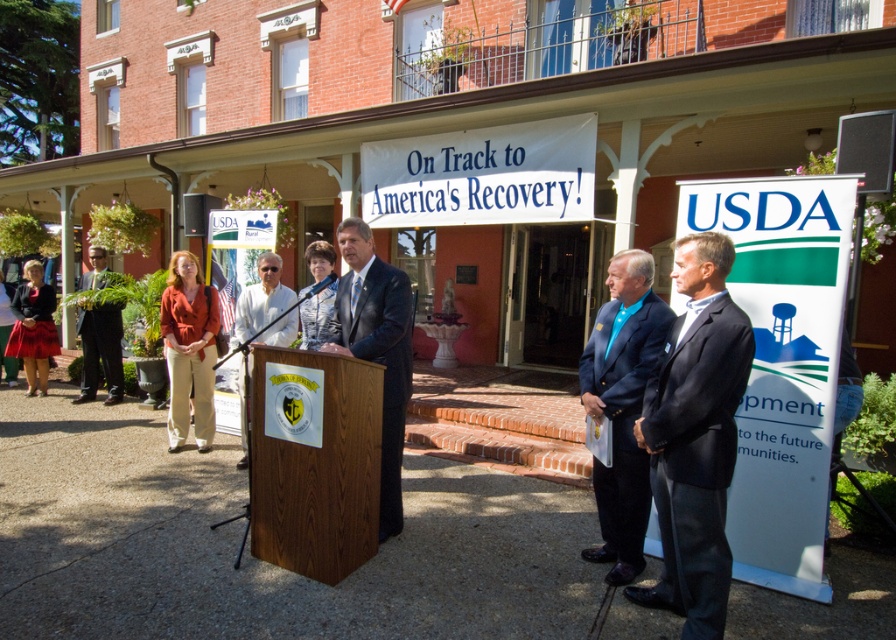
Is blue fabric suit at center bigger than dark suit at center?

Actually, blue fabric suit at center might be smaller than dark suit at center.

How much distance is there between blue fabric suit at center and dark suit at center?

The distance of blue fabric suit at center from dark suit at center is 1.29 meters.

In order to click on blue fabric suit at center in this screenshot , I will do 622,406.

This screenshot has width=896, height=640. What are the coordinates of `blue fabric suit at center` in the screenshot? It's located at (622, 406).

Between point (675, 413) and point (360, 307), which one is positioned behind?

The point (360, 307) is more distant.

Is dark gray suit at center below dark suit at center?

Yes, dark gray suit at center is below dark suit at center.

Between point (681, 483) and point (399, 509), which one is positioned behind?

The point (399, 509) is more distant.

Identify the location of dark gray suit at center. (695, 436).

Does dark gray suit at center appear over matte black jacket at lower left?

No.

Does dark gray suit at center have a larger size compared to matte black jacket at lower left?

Incorrect, dark gray suit at center is not larger than matte black jacket at lower left.

At what (x,y) coordinates should I click in order to perform the action: click on dark gray suit at center. Please return your answer as a coordinate pair (x, y). This screenshot has width=896, height=640. Looking at the image, I should click on (695, 436).

Where is `dark gray suit at center`? dark gray suit at center is located at coordinates (695, 436).